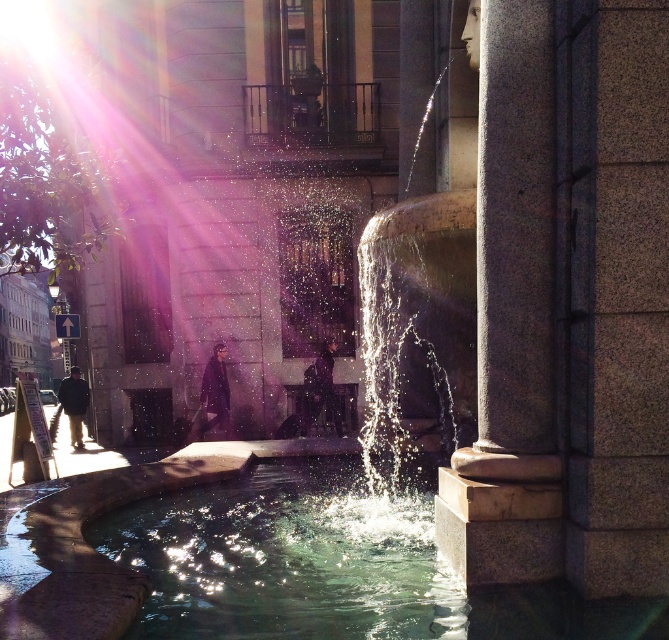
You are a photographer standing in front of the fountain. You want to take a photo that includes both the granite column at center and the clear glass water at center. Which object will appear closer to the camera in the photo?

The granite column at center will appear closer to the camera in the photo because it is positioned in front of the clear glass water at center.

You are a maintenance worker inspecting the fountain. You notice the granite column at center and the clear glass water at center. Which object is positioned higher in the scene?

The granite column at center is positioned higher than the clear glass water at center according to the scene description.

You are a city planner assessing the fountain in the urban scene. You need to determine if the clear glass water at center can be seen above the granite column at center. Based on their heights, what is your conclusion?

The granite column at center is much taller than the clear glass water at center, so the clear glass water at center cannot be seen above the granite column at center.